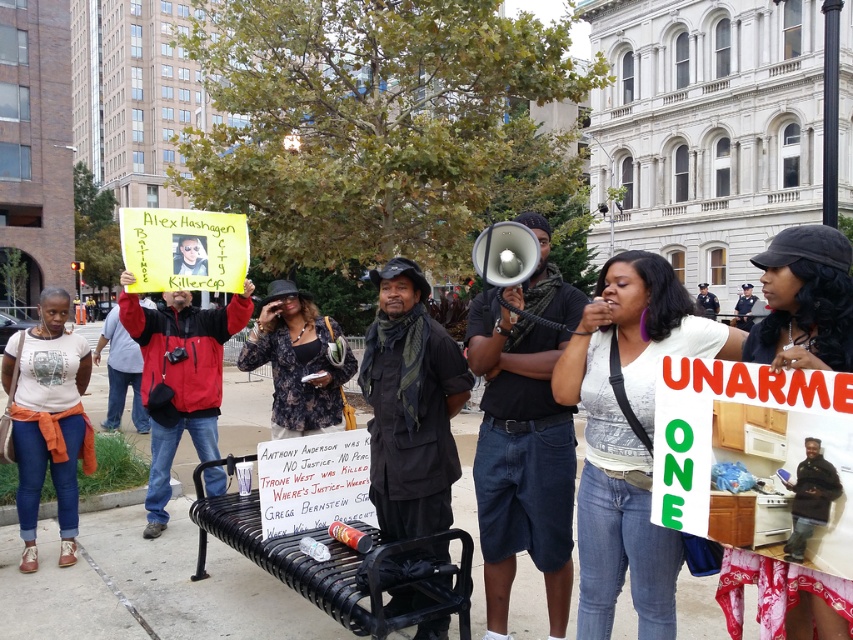
Which is below, black metal bench at center or matte white t-shirt at center?

black metal bench at center is lower down.

Can you confirm if black metal bench at center is wider than matte white t-shirt at center?

Indeed, black metal bench at center has a greater width compared to matte white t-shirt at center.

The width and height of the screenshot is (853, 640). Describe the element at coordinates (341, 563) in the screenshot. I see `black metal bench at center` at that location.

You are a GUI agent. You are given a task and a screenshot of the screen. Output one action in this format:
    pyautogui.click(x=<x>, y=<y>)
    Task: Click on the black metal bench at center
    This screenshot has width=853, height=640.
    Given the screenshot: What is the action you would take?
    pyautogui.click(x=341, y=563)

Can you confirm if white cotton shirt at center is positioned to the right of black fabric hat at upper center?

In fact, white cotton shirt at center is to the left of black fabric hat at upper center.

At what (x,y) coordinates should I click in order to perform the action: click on white cotton shirt at center. Please return your answer as a coordinate pair (x, y). Looking at the image, I should click on (628, 435).

The image size is (853, 640). Identify the location of white cotton shirt at center. (628, 435).

Is white cotton shirt at center smaller than floral dress at center?

No, white cotton shirt at center is not smaller than floral dress at center.

From the picture: Who is positioned more to the right, white cotton shirt at center or floral dress at center?

white cotton shirt at center is more to the right.

What do you see at coordinates (628, 435) in the screenshot? The image size is (853, 640). I see `white cotton shirt at center` at bounding box center [628, 435].

Find the location of a particular element. This screenshot has height=640, width=853. white cotton shirt at center is located at coordinates click(x=628, y=435).